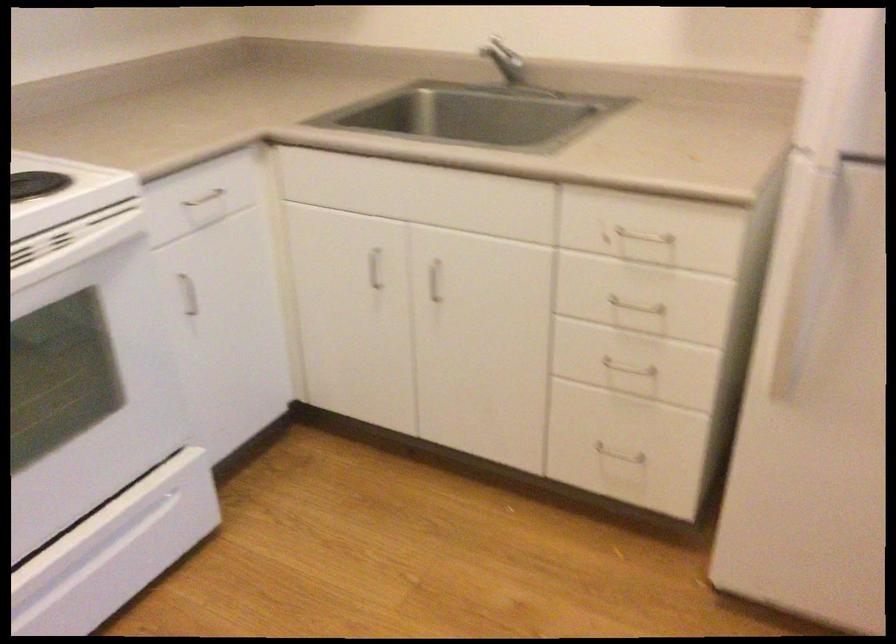
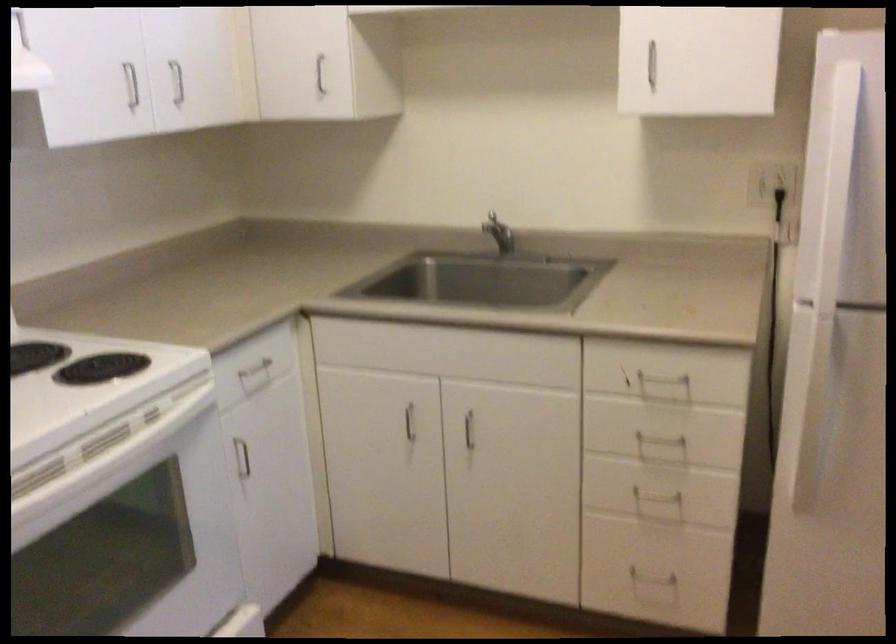
The point at (434,279) is marked in the first image. Where is the corresponding point in the second image?

(469, 430)